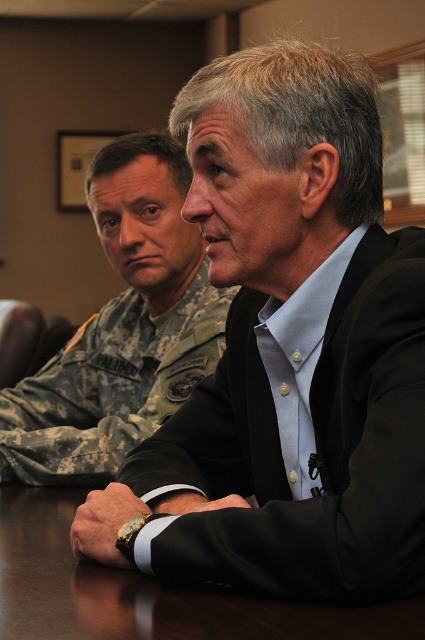
Question: Is black matte suit at center to the right of camouflage uniform at left from the viewer's perspective?

Choices:
 (A) yes
 (B) no

Answer: (A)

Question: Which point is closer to the camera?

Choices:
 (A) (112, 228)
 (B) (25, 588)
 (C) (218, 86)

Answer: (B)

Question: Which point is farther from the camera taking this photo?

Choices:
 (A) (161, 598)
 (B) (65, 378)
 (C) (268, 166)

Answer: (B)

Question: Can you confirm if black matte suit at center is bigger than dark brown wood table at center?

Choices:
 (A) yes
 (B) no

Answer: (A)

Question: Which object appears farthest from the camera in this image?

Choices:
 (A) dark brown wood table at center
 (B) black matte suit at center

Answer: (B)

Question: Is black matte suit at center to the left of camouflage uniform at left from the viewer's perspective?

Choices:
 (A) yes
 (B) no

Answer: (B)